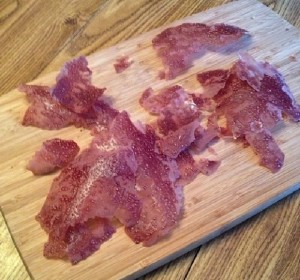
This screenshot has height=280, width=300. I want to click on crack in wooden countertop, so click(x=190, y=265).